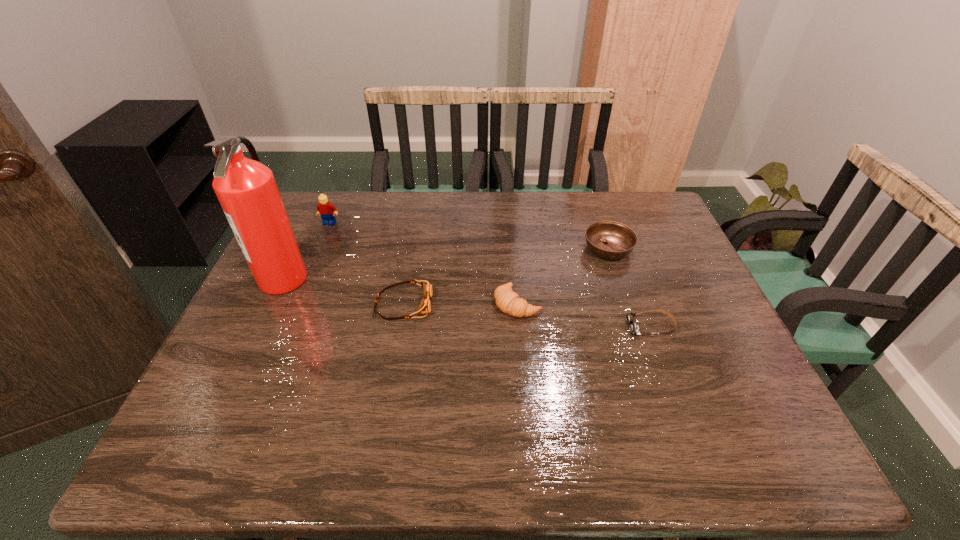
Image resolution: width=960 pixels, height=540 pixels. In order to click on vacant space located on the front-facing side of the farthest object in this screenshot , I will do `click(317, 253)`.

The height and width of the screenshot is (540, 960). I want to click on vacant space located on the front of the fourth object from left to right, so click(x=524, y=390).

Find the location of a particular element. free space located on the front of the soup bowl is located at coordinates (626, 303).

Locate an element on the screen. The width and height of the screenshot is (960, 540). vacant position located with the lenses facing forward on the taller goggles is located at coordinates (530, 305).

The height and width of the screenshot is (540, 960). Find the location of `vacant space positioned 0.360m on the front-facing side of the shortest object`. vacant space positioned 0.360m on the front-facing side of the shortest object is located at coordinates (484, 327).

Identify the location of free space located 0.210m on the front-facing side of the shortest object. This screenshot has width=960, height=540. (544, 327).

Find the location of `vacant position located 0.120m on the front-facing side of the shortest object`. vacant position located 0.120m on the front-facing side of the shortest object is located at coordinates (580, 327).

The width and height of the screenshot is (960, 540). What are the coordinates of `object that is at the far edge` in the screenshot? It's located at point(325,208).

Where is `fire extinguisher at the left edge`? The height and width of the screenshot is (540, 960). fire extinguisher at the left edge is located at coordinates (246, 189).

Identify the location of Lego that is at the left edge. The width and height of the screenshot is (960, 540). (325, 208).